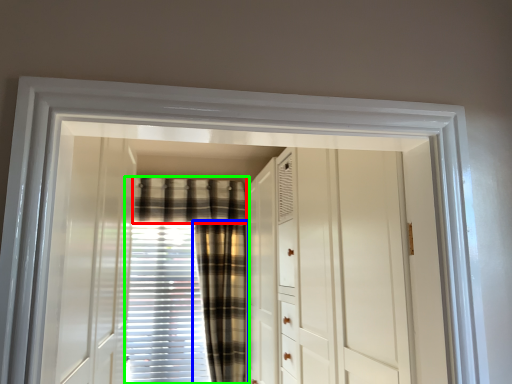
Question: Which object is positioned farthest from plaid (highlighted by a red box)? Select from curtain (highlighted by a blue box) and curtain (highlighted by a green box).

Choices:
 (A) curtain
 (B) curtain

Answer: (A)